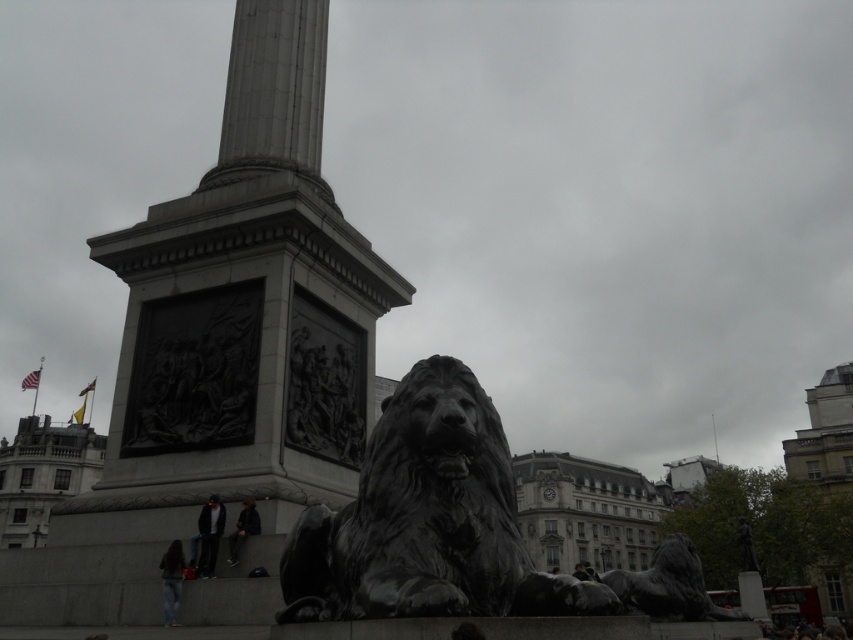
Is dark gray jeans at lower left to the right of dark gray jacket at lower center from the viewer's perspective?

No, dark gray jeans at lower left is not to the right of dark gray jacket at lower center.

At what (x,y) coordinates should I click in order to perform the action: click on dark gray jeans at lower left. Please return your answer as a coordinate pair (x, y). The width and height of the screenshot is (853, 640). Looking at the image, I should click on (172, 580).

Find the location of `dark gray jeans at lower left`. dark gray jeans at lower left is located at coordinates (172, 580).

Does black polished stone lion at center have a lesser width compared to dark gray jeans at lower left?

In fact, black polished stone lion at center might be wider than dark gray jeans at lower left.

Which is more to the left, black polished stone lion at center or dark gray jeans at lower left?

dark gray jeans at lower left is more to the left.

Describe the element at coordinates (427, 520) in the screenshot. The width and height of the screenshot is (853, 640). I see `black polished stone lion at center` at that location.

Identify the location of black polished stone lion at center. (427, 520).

Which is more to the left, dark gray suit at lower left or dark gray jacket at lower center?

Positioned to the left is dark gray suit at lower left.

Which of these two, dark gray suit at lower left or dark gray jacket at lower center, stands taller?

Standing taller between the two is dark gray suit at lower left.

Describe the element at coordinates (209, 534) in the screenshot. This screenshot has height=640, width=853. I see `dark gray suit at lower left` at that location.

This screenshot has width=853, height=640. I want to click on dark gray suit at lower left, so click(209, 534).